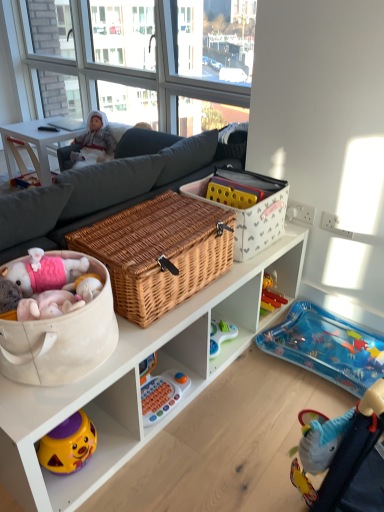
Where is `vacant space in between transparent plastic infant bed at lower right and orange plastic toy at center`? The width and height of the screenshot is (384, 512). vacant space in between transparent plastic infant bed at lower right and orange plastic toy at center is located at coordinates (246, 391).